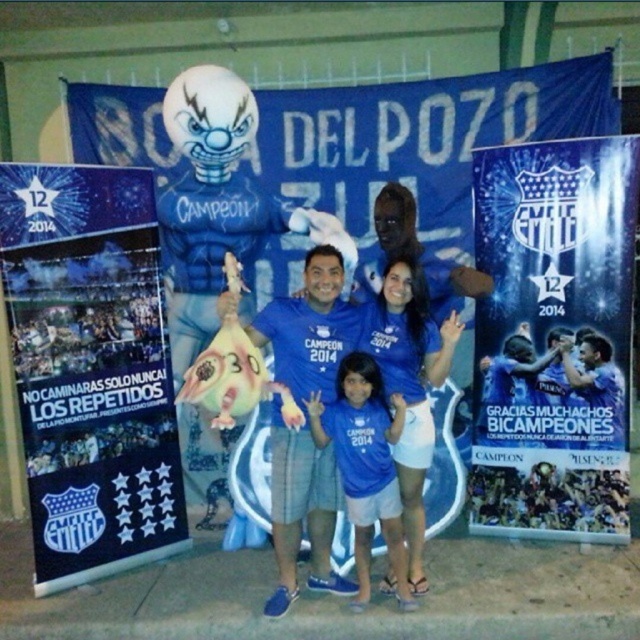
You are a photographer setting up for a group photo. You have a blue paper poster at left and a blue fabric shirt at center. Which object is taller?

The blue paper poster at left is much taller than the blue fabric shirt at center.